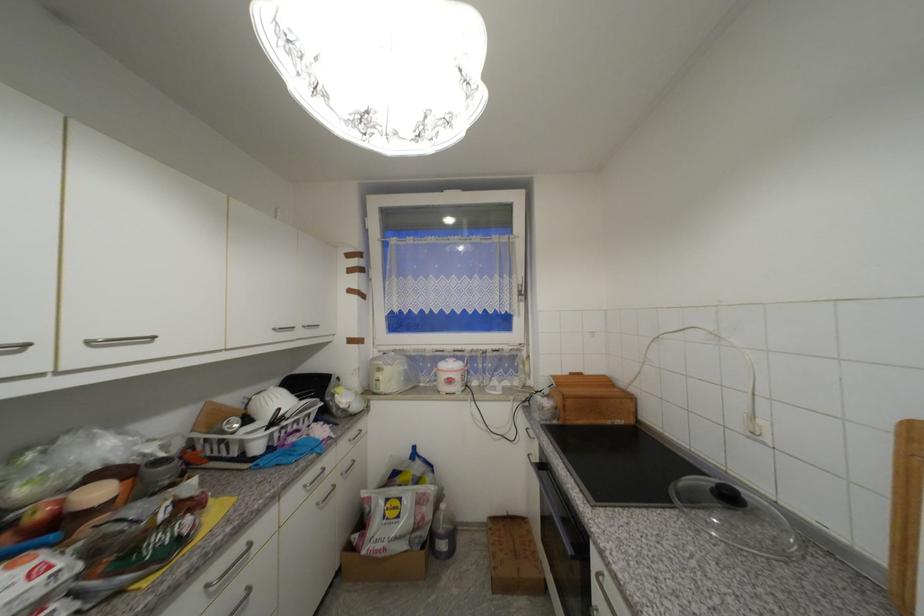
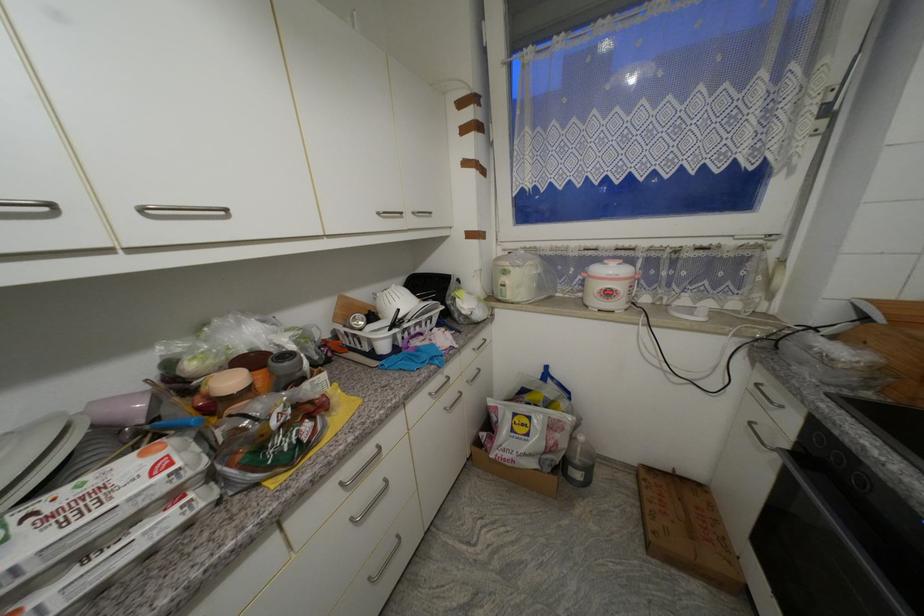
Locate, in the second image, the point that corresponds to [300,428] in the first image.

(423, 331)